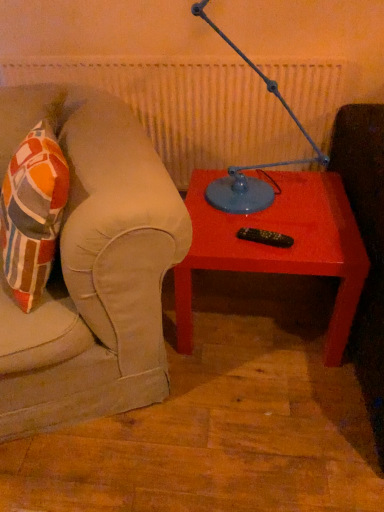
Locate an element on the screen. The image size is (384, 512). free space in front of blue metallic table lamp at upper center is located at coordinates (271, 230).